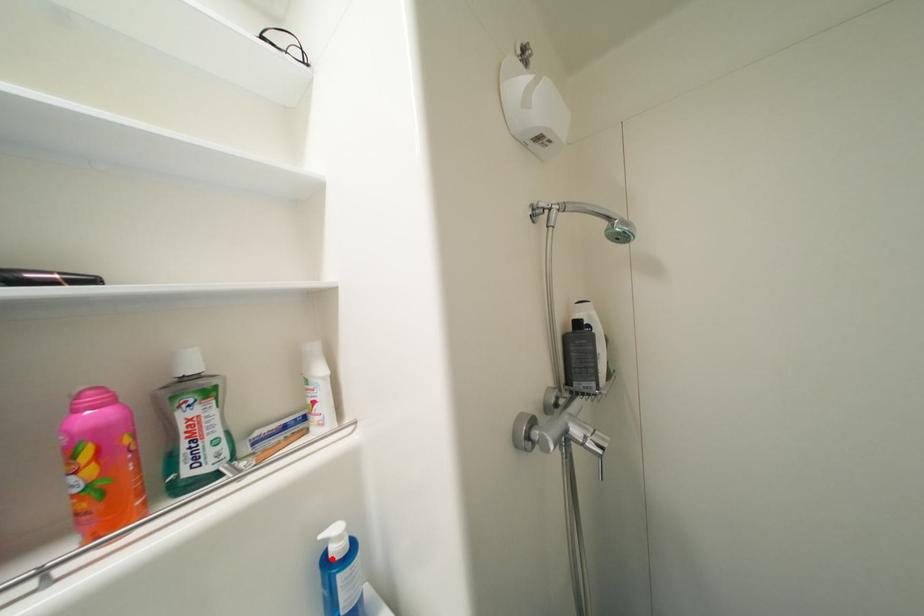
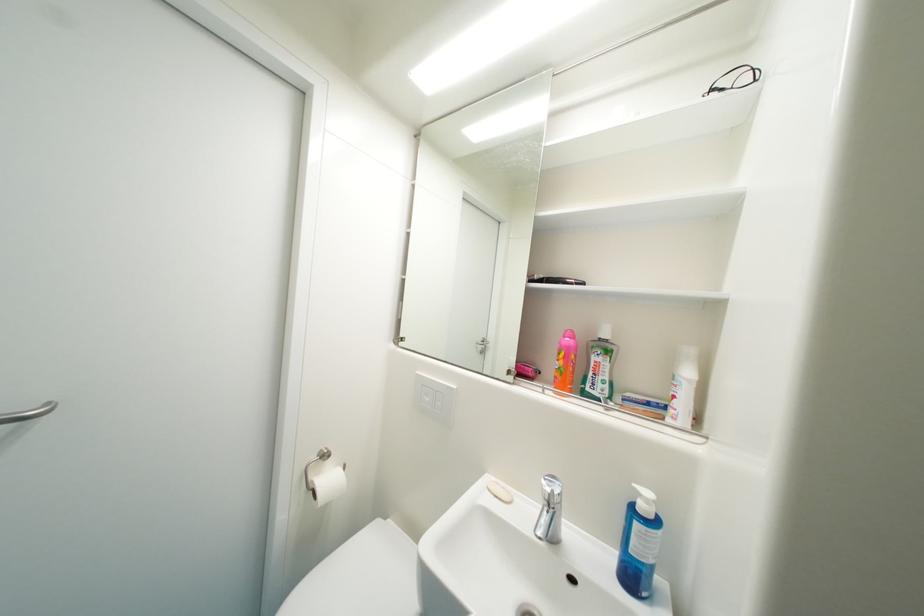
In the second image, find the point that corresponds to the highlighted location in the first image.

(641, 507)